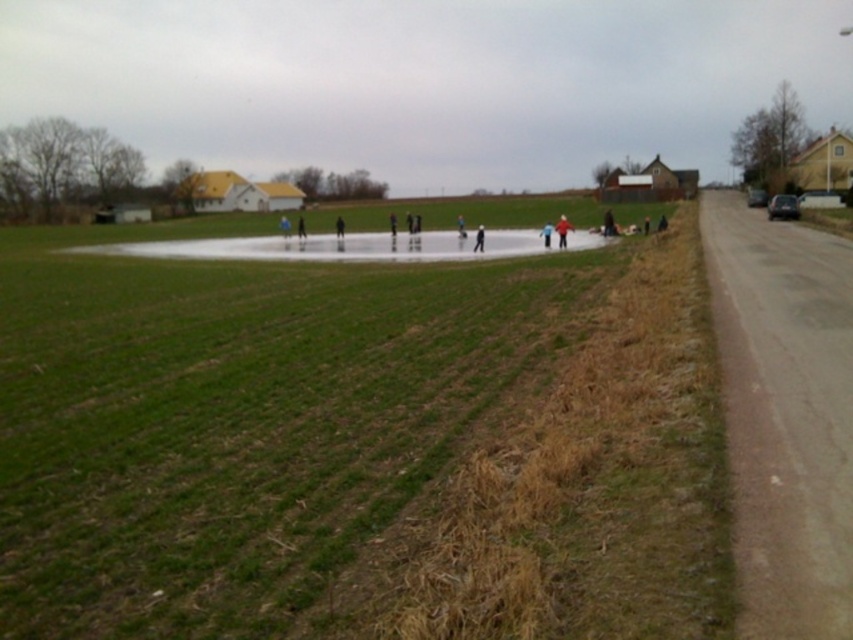
Does green grass at center have a smaller size compared to light blue fabric jacket at center?

No, green grass at center is not smaller than light blue fabric jacket at center.

Is green grass at center below light blue fabric jacket at center?

Indeed, green grass at center is positioned under light blue fabric jacket at center.

At what (x,y) coordinates should I click in order to perform the action: click on green grass at center. Please return your answer as a coordinate pair (x, y). Looking at the image, I should click on (355, 442).